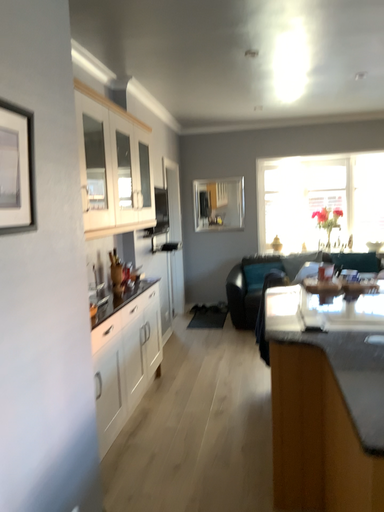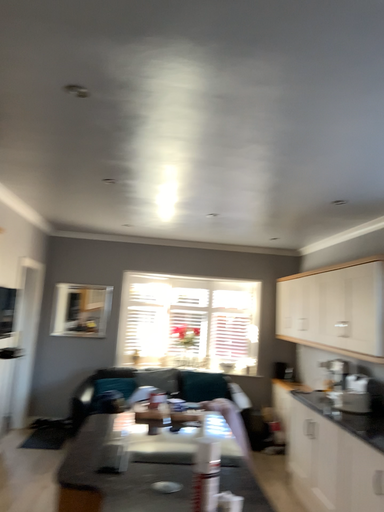
Question: How did the camera likely rotate when shooting the video?

Choices:
 (A) rotated right
 (B) rotated left

Answer: (A)